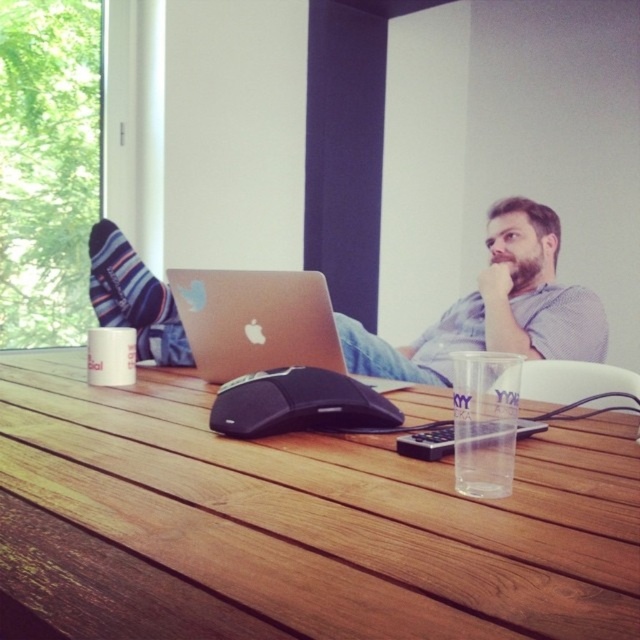
Where is the matte silver laptop at center located in the image?

The matte silver laptop at center is located at point coordinates of (496, 307).

You are organizing a desk space and need to ensure that all items fit within a 12 inch wide drawer. Given the items on the table, which one between the matte silver laptop at center and the black matte mouse at center would not fit in the drawer if the laptop is 14 inches wide?

The matte silver laptop at center would not fit in the drawer since it is 14 inches wide, which exceeds the 12 inch width limit of the drawer.

You are a person sitting at the wooden table at center. You want to reach the black matte mouse at center. Is the mouse located in front of or behind you?

The wooden table at center is in front of the black matte mouse at center, so the mouse is behind you.